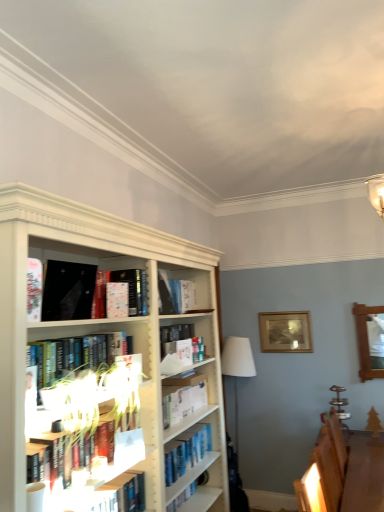
Question: Is matte white paperback book at center, which ranks as the second paperback book in front-to-back order, at the back of matte black book at upper left, the second paperback book in the back-to-front sequence?

Choices:
 (A) no
 (B) yes

Answer: (A)

Question: Does matte black book at upper left, which is the first paperback book from front to back, turn towards matte white paperback book at center, which ranks as the second paperback book in front-to-back order?

Choices:
 (A) yes
 (B) no

Answer: (B)

Question: Considering the relative sizes of matte black book at upper left, the second paperback book in the back-to-front sequence, and matte white paperback book at center, which ranks as the second paperback book in front-to-back order, in the image provided, is matte black book at upper left, the second paperback book in the back-to-front sequence, wider than matte white paperback book at center, which ranks as the second paperback book in front-to-back order,?

Choices:
 (A) no
 (B) yes

Answer: (B)

Question: Is the position of matte black book at upper left, the second paperback book in the back-to-front sequence, less distant than that of matte white paperback book at center, acting as the first paperback book starting from the back?

Choices:
 (A) no
 (B) yes

Answer: (B)

Question: Can we say matte black book at upper left, which is the first paperback book from front to back, lies outside matte white paperback book at center, which ranks as the second paperback book in front-to-back order?

Choices:
 (A) no
 (B) yes

Answer: (B)

Question: Based on their sizes in the image, would you say hardcover book at center, the 3th book ordered from the bottom, is bigger or smaller than matte black book at upper left, which is the first paperback book from front to back?

Choices:
 (A) small
 (B) big

Answer: (A)

Question: Considering their positions, is hardcover book at center, the 3th book ordered from the bottom, located in front of or behind matte black book at upper left, which is the first paperback book from front to back?

Choices:
 (A) front
 (B) behind

Answer: (B)

Question: From the image's perspective, is hardcover book at center, the 3th book ordered from the bottom, located above or below matte black book at upper left, which is the first paperback book from front to back?

Choices:
 (A) below
 (B) above

Answer: (A)

Question: From a real-world perspective, is hardcover book at center, which is the first book in top-to-bottom order, above or below matte black book at upper left, the second paperback book in the back-to-front sequence?

Choices:
 (A) above
 (B) below

Answer: (B)

Question: From the image's perspective, is hardcover book at center, arranged as the 1th book when ordered from the bottom, above or below matte black book at upper left, the second paperback book in the back-to-front sequence?

Choices:
 (A) above
 (B) below

Answer: (B)

Question: Based on their positions, is hardcover book at center, which is the 3th book from top to bottom, located to the left or right of matte black book at upper left, which is the first paperback book from front to back?

Choices:
 (A) left
 (B) right

Answer: (B)

Question: From a real-world perspective, is hardcover book at center, arranged as the 1th book when ordered from the bottom, positioned above or below matte black book at upper left, the second paperback book in the back-to-front sequence?

Choices:
 (A) above
 (B) below

Answer: (B)

Question: In terms of height, does hardcover book at center, arranged as the 1th book when ordered from the bottom, look taller or shorter compared to matte black book at upper left, which is the first paperback book from front to back?

Choices:
 (A) short
 (B) tall

Answer: (A)

Question: From a real-world perspective, is wooden table at lower right physically located above or below white fabric lampshade at center?

Choices:
 (A) below
 (B) above

Answer: (B)

Question: Considering their positions, is wooden table at lower right located in front of or behind white fabric lampshade at center?

Choices:
 (A) front
 (B) behind

Answer: (A)